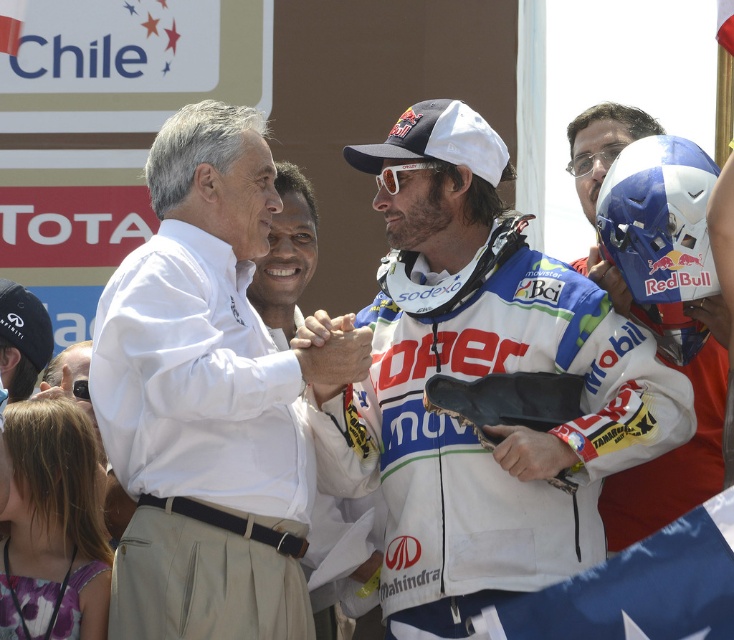
Between point (655, 364) and point (711, 579), which one is positioned in front?

Point (711, 579) is more forward.

Who is higher up, white matte jacket at center or blue fabric flag at center?

Positioned higher is white matte jacket at center.

Who is more distant from viewer, (589, 348) or (586, 604)?

The point (589, 348) is behind.

I want to click on white matte jacket at center, so 476,378.

Is point (658, 337) positioned before point (385, 186)?

That is True.

Is blue matte helmet at right thinner than white matte goggles at center?

Incorrect, blue matte helmet at right's width is not less than white matte goggles at center's.

The image size is (734, 640). What do you see at coordinates (661, 232) in the screenshot?
I see `blue matte helmet at right` at bounding box center [661, 232].

Where is `blue matte helmet at right`? The height and width of the screenshot is (640, 734). blue matte helmet at right is located at coordinates (661, 232).

Can you confirm if white matte jacket at center is positioned to the left of white cotton shirt at center?

In fact, white matte jacket at center is to the right of white cotton shirt at center.

Who is more distant from viewer, (555,292) or (239,380)?

The point (555,292) is behind.

Who is more forward, (508, 316) or (208, 461)?

Point (208, 461) is in front.

At what (x,y) coordinates should I click in order to perform the action: click on white matte jacket at center. Please return your answer as a coordinate pair (x, y). The width and height of the screenshot is (734, 640). Looking at the image, I should click on (476, 378).